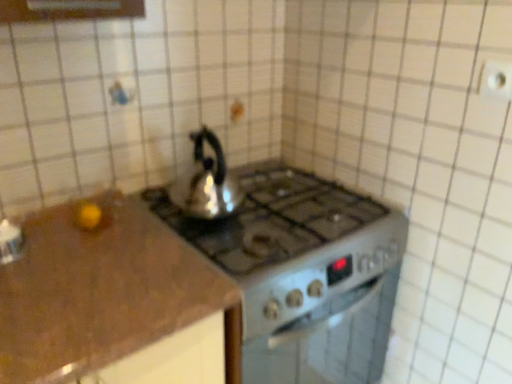
Question: Can you confirm if shiny metallic kettle at center is bigger than satin silver gas stove at center?

Choices:
 (A) yes
 (B) no

Answer: (B)

Question: Does shiny metallic kettle at center turn towards satin silver gas stove at center?

Choices:
 (A) no
 (B) yes

Answer: (A)

Question: Would you say satin silver gas stove at center is part of shiny metallic kettle at center's contents?

Choices:
 (A) yes
 (B) no

Answer: (B)

Question: Considering the relative sizes of shiny metallic kettle at center and satin silver gas stove at center in the image provided, is shiny metallic kettle at center thinner than satin silver gas stove at center?

Choices:
 (A) yes
 (B) no

Answer: (A)

Question: Is shiny metallic kettle at center positioned beyond the bounds of satin silver gas stove at center?

Choices:
 (A) yes
 (B) no

Answer: (A)

Question: Looking at the image, does white plastic electric outlet at upper right seem bigger or smaller compared to shiny metallic kettle at center?

Choices:
 (A) big
 (B) small

Answer: (B)

Question: Considering the positions of white plastic electric outlet at upper right and shiny metallic kettle at center in the image, is white plastic electric outlet at upper right wider or thinner than shiny metallic kettle at center?

Choices:
 (A) wide
 (B) thin

Answer: (B)

Question: Considering their positions, is white plastic electric outlet at upper right located in front of or behind shiny metallic kettle at center?

Choices:
 (A) front
 (B) behind

Answer: (A)

Question: Is white plastic electric outlet at upper right to the left or to the right of shiny metallic kettle at center in the image?

Choices:
 (A) right
 (B) left

Answer: (A)

Question: In the image, is shiny metallic kettle at center on the left side or the right side of white plastic electric outlet at upper right?

Choices:
 (A) left
 (B) right

Answer: (A)

Question: From a real-world perspective, is shiny metallic kettle at center above or below white plastic electric outlet at upper right?

Choices:
 (A) above
 (B) below

Answer: (B)

Question: Is shiny metallic kettle at center situated inside white plastic electric outlet at upper right or outside?

Choices:
 (A) outside
 (B) inside

Answer: (A)

Question: Looking at the image, does shiny metallic kettle at center seem bigger or smaller compared to white plastic electric outlet at upper right?

Choices:
 (A) big
 (B) small

Answer: (A)

Question: Would you say shiny metallic kettle at center is to the left or to the right of satin silver gas stove at center in the picture?

Choices:
 (A) right
 (B) left

Answer: (B)

Question: Do you think shiny metallic kettle at center is within satin silver gas stove at center, or outside of it?

Choices:
 (A) outside
 (B) inside

Answer: (A)